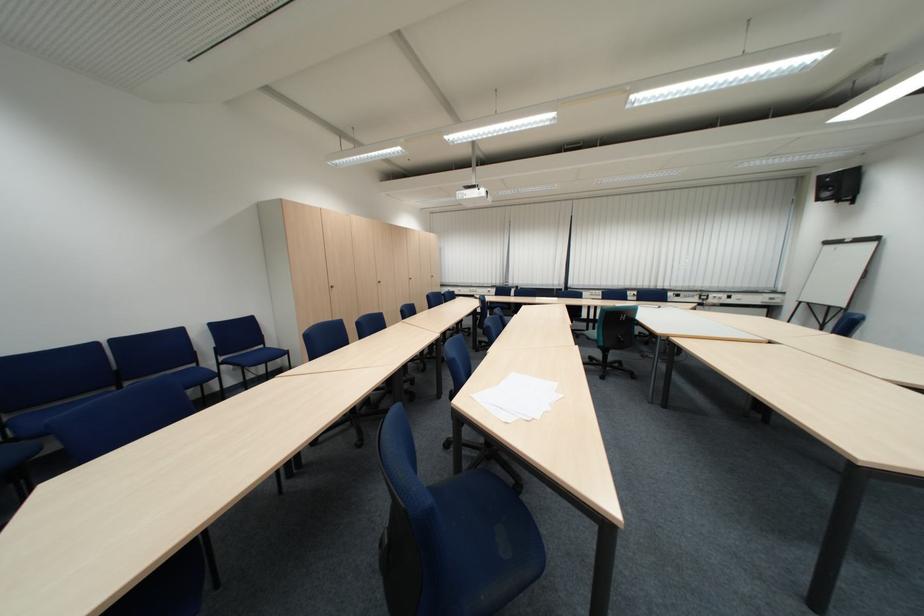
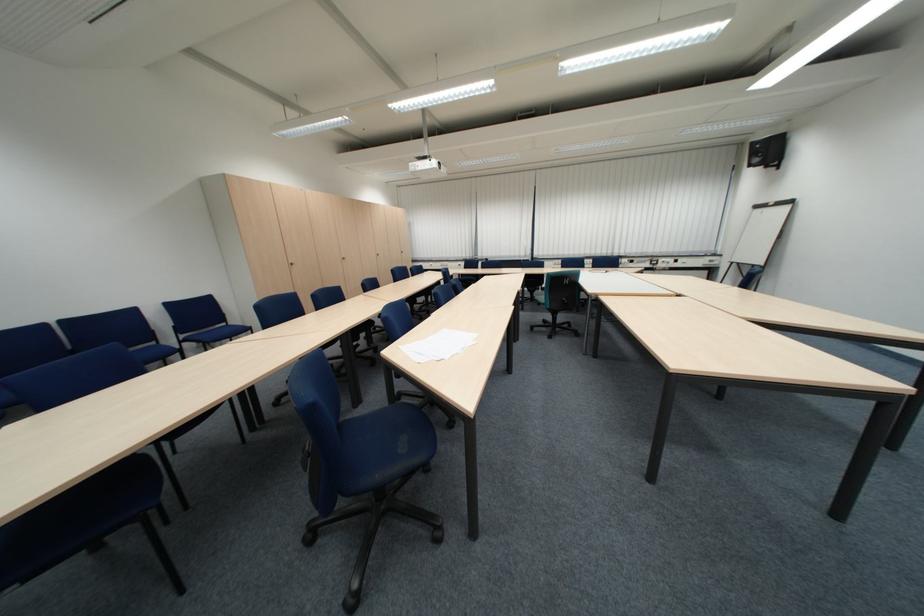
In the second image, find the point that corresponds to point (274, 347) in the first image.

(237, 326)